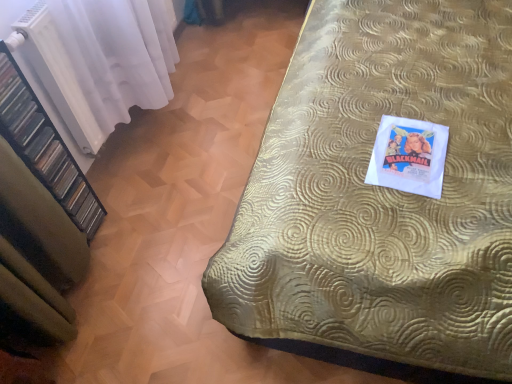
Question: Would you say gold textured bedspread at upper right is a long distance from white sheer curtain at left?

Choices:
 (A) yes
 (B) no

Answer: (B)

Question: From the image's perspective, does gold textured bedspread at upper right appear lower than white sheer curtain at left?

Choices:
 (A) no
 (B) yes

Answer: (B)

Question: Is gold textured bedspread at upper right smaller than white sheer curtain at left?

Choices:
 (A) no
 (B) yes

Answer: (A)

Question: Could white sheer curtain at left be considered to be inside gold textured bedspread at upper right?

Choices:
 (A) no
 (B) yes

Answer: (A)

Question: Is gold textured bedspread at upper right completely or partially outside of white sheer curtain at left?

Choices:
 (A) no
 (B) yes

Answer: (B)

Question: Can you confirm if gold textured bedspread at upper right is thinner than white sheer curtain at left?

Choices:
 (A) yes
 (B) no

Answer: (B)

Question: Can you confirm if black plastic shelf at left is bigger than gold textured bedspread at upper right?

Choices:
 (A) yes
 (B) no

Answer: (B)

Question: Is black plastic shelf at left taller than gold textured bedspread at upper right?

Choices:
 (A) no
 (B) yes

Answer: (B)

Question: Is black plastic shelf at left positioned beyond the bounds of gold textured bedspread at upper right?

Choices:
 (A) no
 (B) yes

Answer: (B)

Question: Does black plastic shelf at left lie behind gold textured bedspread at upper right?

Choices:
 (A) no
 (B) yes

Answer: (A)

Question: Is the surface of black plastic shelf at left in direct contact with gold textured bedspread at upper right?

Choices:
 (A) no
 (B) yes

Answer: (A)

Question: From a real-world perspective, does black plastic shelf at left stand above gold textured bedspread at upper right?

Choices:
 (A) yes
 (B) no

Answer: (A)

Question: Would you say black plastic shelf at left is part of gold textured bedspread at upper right's contents?

Choices:
 (A) yes
 (B) no

Answer: (B)